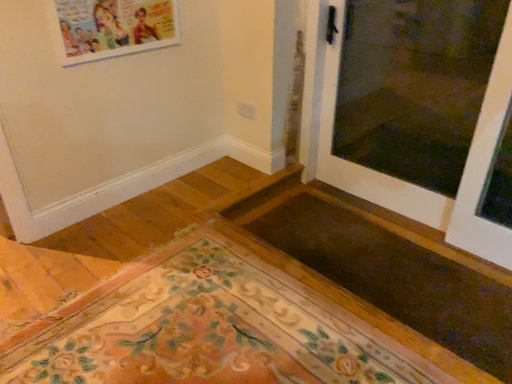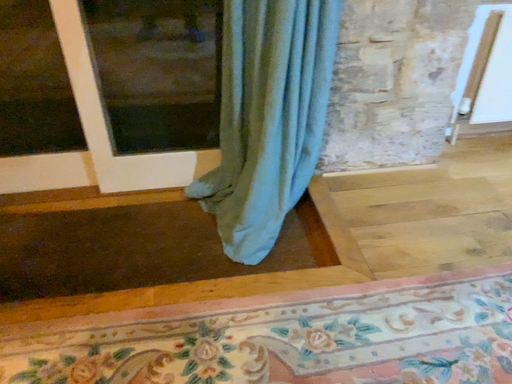
Question: Which way did the camera rotate in the video?

Choices:
 (A) rotated upward
 (B) rotated downward

Answer: (A)